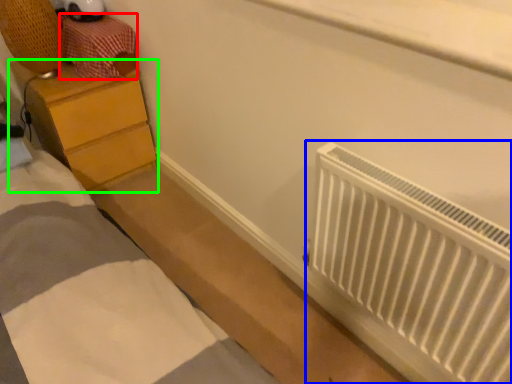
Question: Which is farther away from drawer (highlighted by a red box)? radiator (highlighted by a blue box) or chest of drawers (highlighted by a green box)?

Choices:
 (A) radiator
 (B) chest of drawers

Answer: (A)